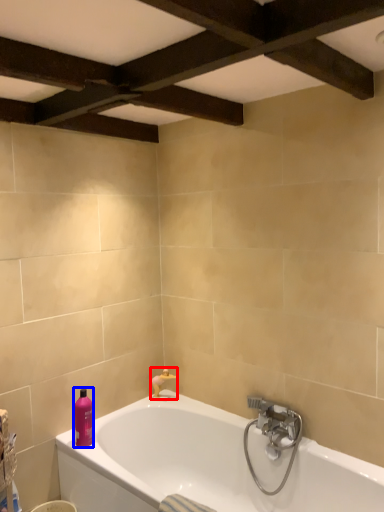
Question: Among these objects, which one is nearest to the camera, faucet (highlighted by a red box) or toiletry (highlighted by a blue box)?

Choices:
 (A) faucet
 (B) toiletry

Answer: (B)